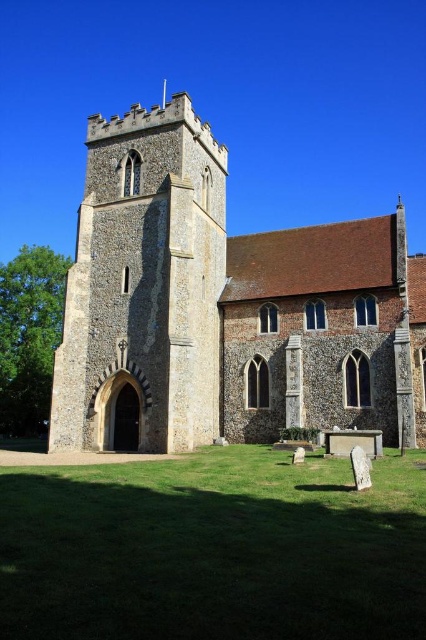
Question: Which point appears farthest from the camera in this image?

Choices:
 (A) (425, 337)
 (B) (63, 368)

Answer: (B)

Question: Can you confirm if stone tower at center is positioned below stone tower at left?

Choices:
 (A) yes
 (B) no

Answer: (B)

Question: From the image, what is the correct spatial relationship of stone tower at center in relation to stone tower at left?

Choices:
 (A) above
 (B) below

Answer: (A)

Question: Among these objects, which one is farthest from the camera?

Choices:
 (A) stone tower at center
 (B) stone tower at left

Answer: (A)

Question: In this image, where is stone tower at center located relative to stone tower at left?

Choices:
 (A) left
 (B) right

Answer: (B)

Question: Which point appears closest to the camera in this image?

Choices:
 (A) pyautogui.click(x=92, y=124)
 (B) pyautogui.click(x=158, y=314)

Answer: (B)